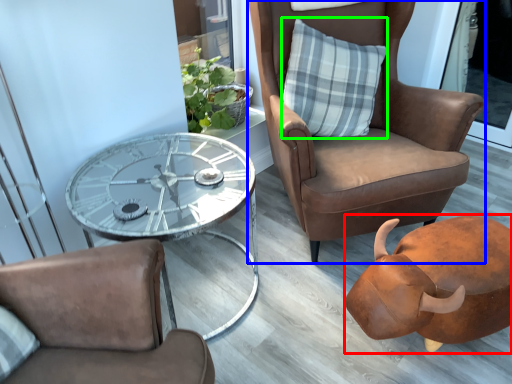
Question: Which is farther away from piggy bank (highlighted by a red box)? chair (highlighted by a blue box) or pillow (highlighted by a green box)?

Choices:
 (A) chair
 (B) pillow

Answer: (B)